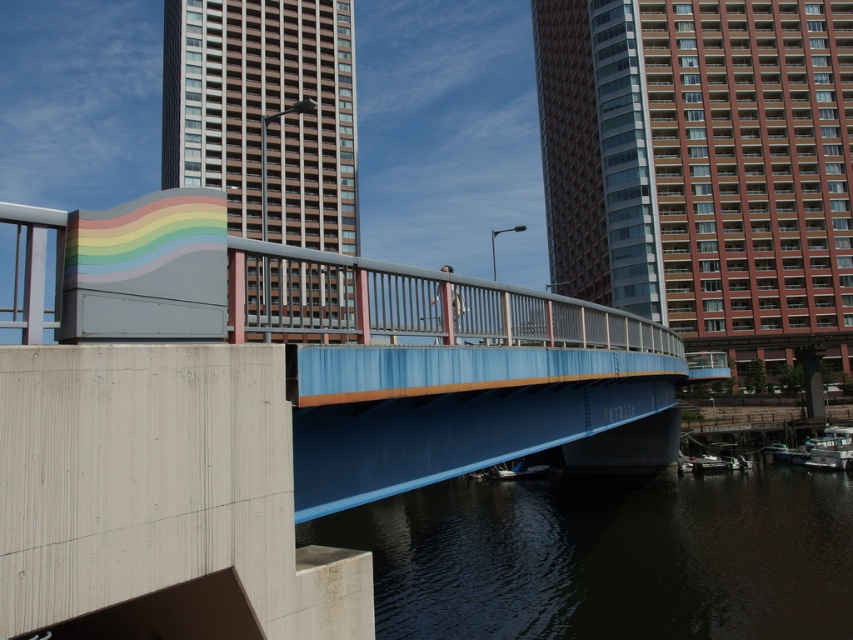
Question: Is brick textured building at upper right thinner than dark water at lower center?

Choices:
 (A) yes
 (B) no

Answer: (B)

Question: Considering the relative positions of dark water at lower center and matte gray building at center in the image provided, where is dark water at lower center located with respect to matte gray building at center?

Choices:
 (A) below
 (B) above

Answer: (A)

Question: From the image, what is the correct spatial relationship of brick textured building at upper right in relation to matte gray building at center?

Choices:
 (A) below
 (B) above

Answer: (B)

Question: Which point is closer to the camera?

Choices:
 (A) [811, 531]
 (B) [337, 150]
 (C) [753, 305]

Answer: (A)

Question: Which point is farther to the camera?

Choices:
 (A) matte gray building at center
 (B) dark water at lower center

Answer: (A)

Question: Which object is positioned farthest from the matte gray building at center?

Choices:
 (A) brick textured building at upper right
 (B) dark water at lower center

Answer: (B)